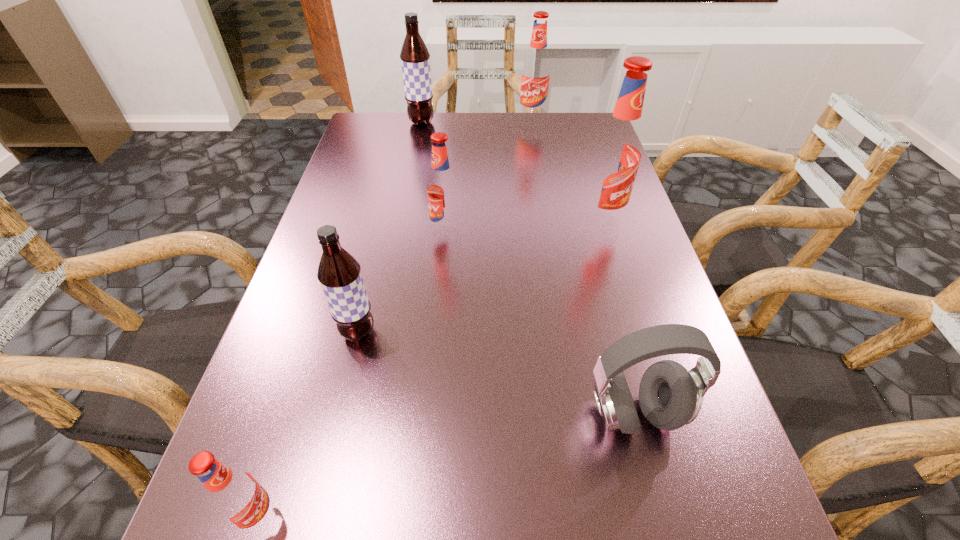
You are a GUI agent. You are given a task and a screenshot of the screen. Output one action in this format:
    pyautogui.click(x=<x>, y=<y>)
    Task: Click on the free space between the bigger brown root beer and the tallest root beer
    This screenshot has height=540, width=960.
    Given the screenshot: What is the action you would take?
    pyautogui.click(x=511, y=172)

You are a GUI agent. You are given a task and a screenshot of the screen. Output one action in this format:
    pyautogui.click(x=<x>, y=<y>)
    Task: Click on the free space between the second nearest root beer and the second nearest object
    The image size is (960, 540).
    Given the screenshot: What is the action you would take?
    pyautogui.click(x=496, y=373)

Identify the location of vacant area that lies between the headset and the farther brown root beer. (528, 268).

You are a GUI agent. You are given a task and a screenshot of the screen. Output one action in this format:
    pyautogui.click(x=<x>, y=<y>)
    Task: Click on the free spot between the second red root beer from left to right and the fifth farthest root beer
    This screenshot has height=540, width=960.
    Given the screenshot: What is the action you would take?
    pyautogui.click(x=402, y=283)

The height and width of the screenshot is (540, 960). Find the location of `empty space that is in between the fifth root beer from left to right and the second nearest object`. empty space that is in between the fifth root beer from left to right and the second nearest object is located at coordinates (584, 267).

Where is `vacant space in between the smaller brown root beer and the fourth object from left to right`? The height and width of the screenshot is (540, 960). vacant space in between the smaller brown root beer and the fourth object from left to right is located at coordinates (402, 283).

Identify the location of the second closest object to the rightmost root beer. (670, 396).

Identify the location of object that is the third nearest to the second root beer from right to left. (442, 188).

Select which root beer appears as the third closest to the farther brown root beer. Please provide its 2D coordinates. Your answer should be formatted as a tuple, i.e. [(x, y)], where the tuple contains the x and y coordinates of a point satisfying the conditions above.

[(616, 154)]

Image resolution: width=960 pixels, height=540 pixels. Find the location of `root beer that is the closest to the second red root beer from left to right`. root beer that is the closest to the second red root beer from left to right is located at coordinates (339, 273).